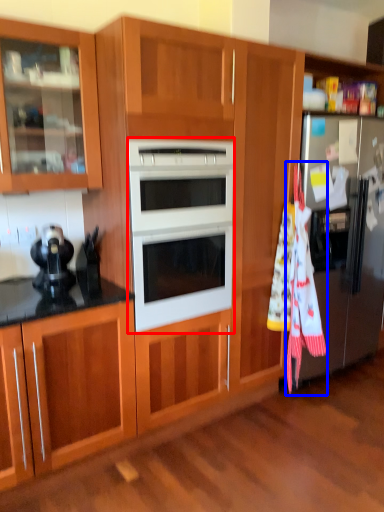
Question: Among these objects, which one is farthest to the camera, microwave oven (highlighted by a red box) or beach towel (highlighted by a blue box)?

Choices:
 (A) microwave oven
 (B) beach towel

Answer: (B)